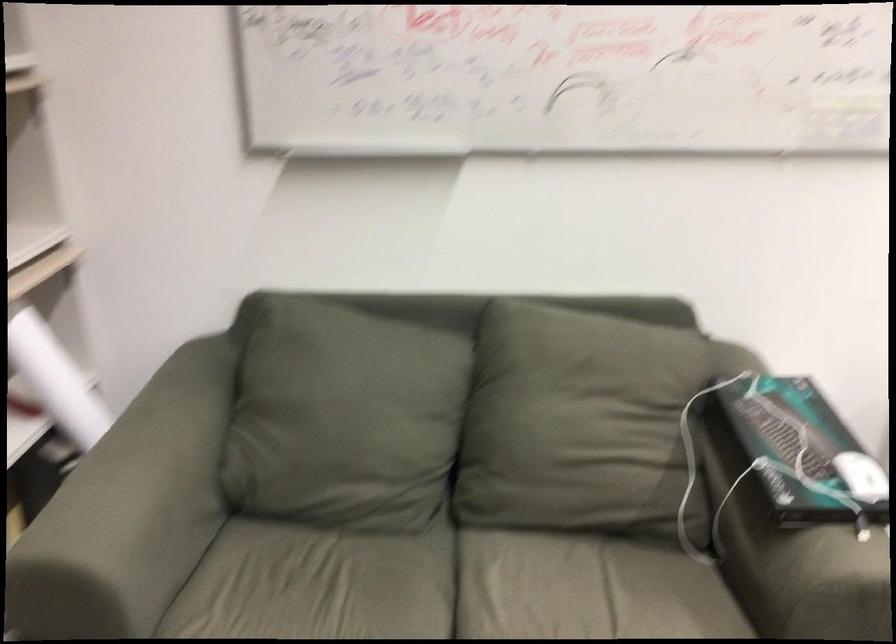
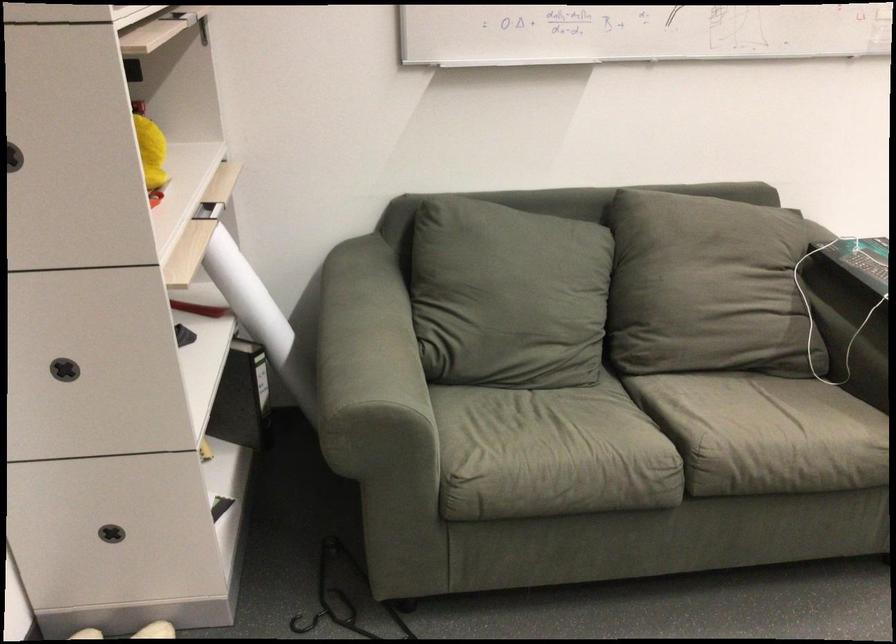
Find the pixel in the second image that matches pixel 561 428 in the first image.

(707, 287)